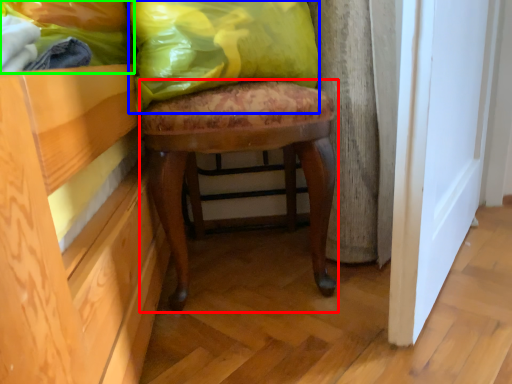
Question: Considering the real-world distances, which object is closest to stool (highlighted by a red box)? throw pillow (highlighted by a blue box) or fabric (highlighted by a green box).

Choices:
 (A) throw pillow
 (B) fabric

Answer: (A)